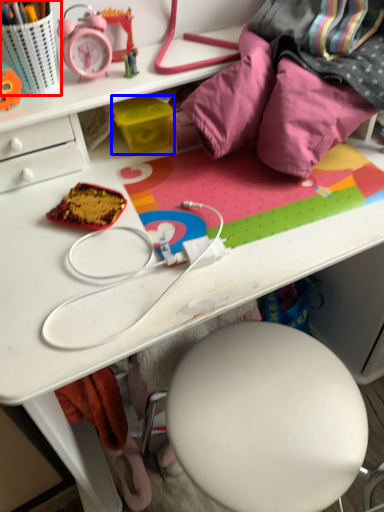
Question: Which of the following is the closest to the observer, stationery (highlighted by a red box) or stationery (highlighted by a blue box)?

Choices:
 (A) stationery
 (B) stationery

Answer: (A)